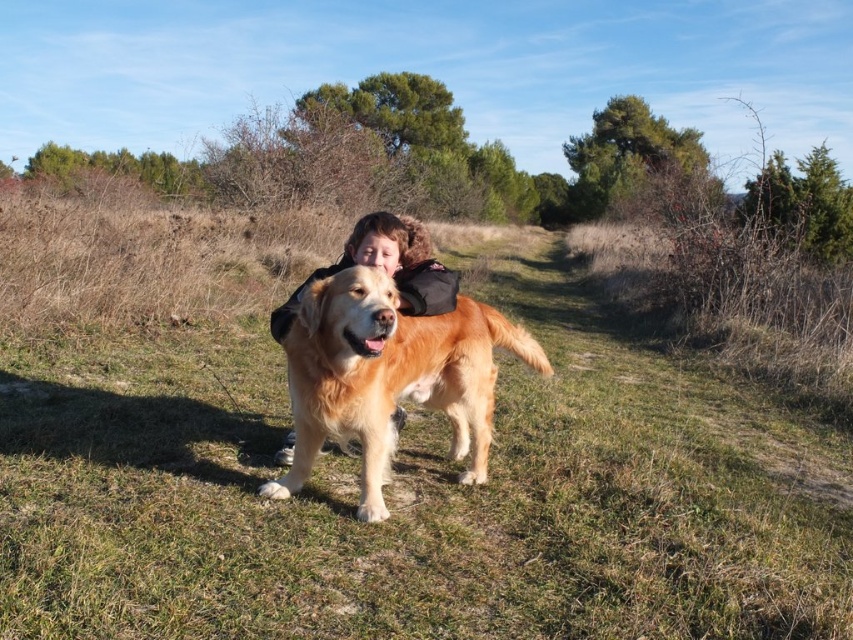
You are standing at the origin point of the coordinate system. The golden fur dog at center is at coordinates approximately 0.588 in the x direction and 0.457 in the y direction. If you want to walk straight towards the dog, in which direction should you move first? Please answer with either left, right, forward, or backward.

Since the golden fur dog at center is located at coordinates approximately 0.588 in the x direction and 0.457 in the y direction, you should move forward to approach it. The x and y values are both positive, indicating the dog is ahead of you in the coordinate system.

You are standing at the point marked by the coordinates point (415, 493). What is the color of the ground beneath you?

The ground beneath you is green grassy at center, as indicated by the coordinates point (415, 493).

You are a photographer trying to capture a closeup of the golden hair at center while ensuring the green grassy at center is still visible in the background. Can you fit both in the frame if your camera has a 100mm lens?

The green grassy at center has a larger size compared to golden hair at center. Since the grassy area is larger, it can be captured in the background while keeping the golden hair at center in focus with a 100mm lens.